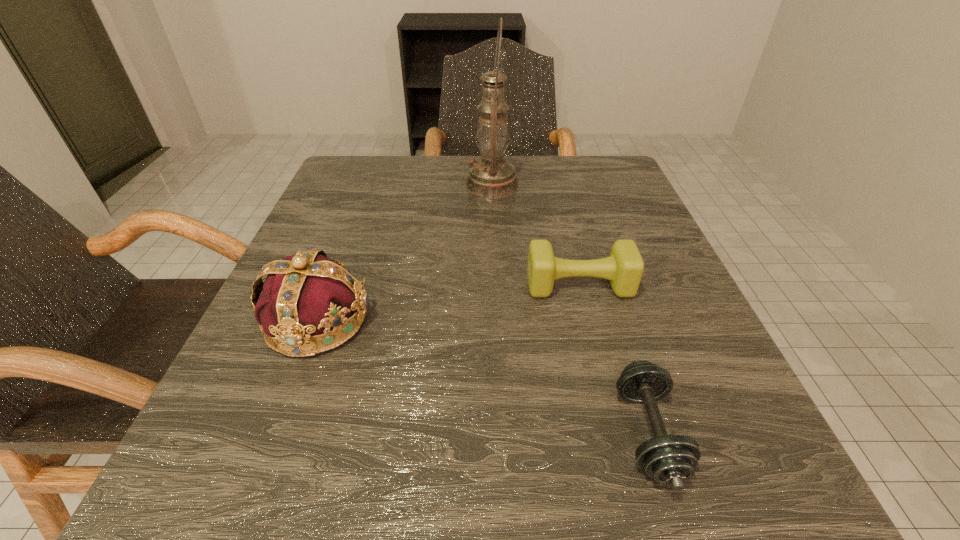
I want to click on free space between the tallest object and the leftmost object, so click(404, 253).

The image size is (960, 540). Identify the location of free spot between the third shortest object and the farthest object. (404, 253).

Locate an element on the screen. This screenshot has height=540, width=960. free area in between the farther dumbbell and the nearest object is located at coordinates (613, 359).

Where is `vacant area between the nearest object and the crown`? This screenshot has height=540, width=960. vacant area between the nearest object and the crown is located at coordinates [483, 377].

The width and height of the screenshot is (960, 540). Find the location of `vacant area that lies between the leftmost object and the nearest object`. vacant area that lies between the leftmost object and the nearest object is located at coordinates (483, 377).

Identify the location of free space that is in between the farther dumbbell and the crown. (448, 303).

The width and height of the screenshot is (960, 540). What are the coordinates of `vacant area that lies between the second tallest object and the farther dumbbell` in the screenshot? It's located at (448, 303).

Where is `empty space between the tallest object and the nearest object`? Image resolution: width=960 pixels, height=540 pixels. empty space between the tallest object and the nearest object is located at coordinates (570, 309).

Find the location of a particular element. The height and width of the screenshot is (540, 960). empty space that is in between the farther dumbbell and the leftmost object is located at coordinates (448, 303).

Locate an element on the screen. free spot between the crown and the farthest object is located at coordinates (404, 253).